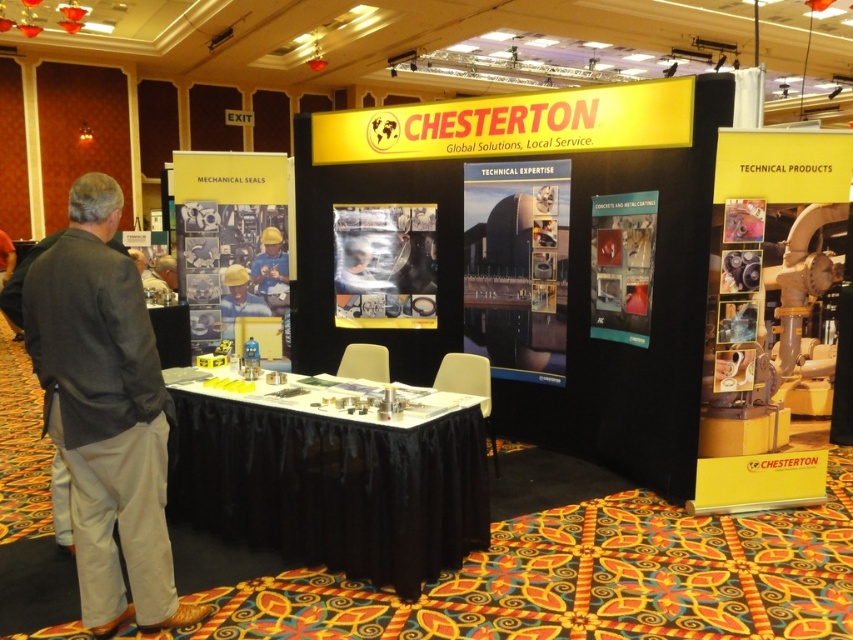
Question: Which is nearer to the yellow hard hat at center?

Choices:
 (A) gray fabric pants at left
 (B) white fabric table at center

Answer: (B)

Question: Which is farther from the white fabric table at center?

Choices:
 (A) yellow hard hat at center
 (B) gray fabric pants at left

Answer: (A)

Question: Does white fabric table at center have a greater width compared to yellow hard hat at center?

Choices:
 (A) yes
 (B) no

Answer: (A)

Question: Can you confirm if white fabric table at center is bigger than yellow hard hat at center?

Choices:
 (A) yes
 (B) no

Answer: (A)

Question: Is white fabric table at center further to camera compared to yellow hard hat at center?

Choices:
 (A) yes
 (B) no

Answer: (B)

Question: Which of the following is the closest to the observer?

Choices:
 (A) white fabric table at center
 (B) yellow hard hat at center
 (C) gray fabric pants at left

Answer: (C)